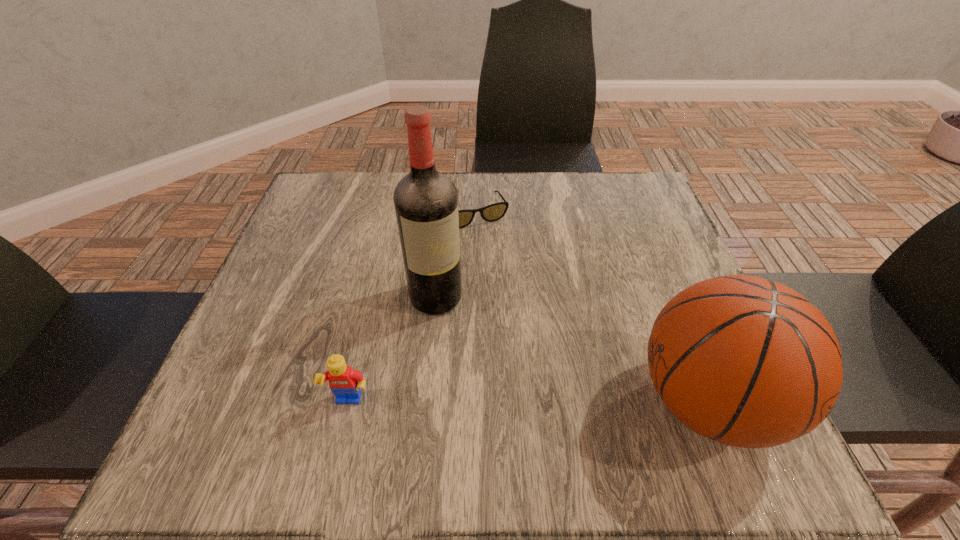
In the image, there is a desktop. In order to click on free space at the far edge in this screenshot , I will do `click(516, 196)`.

In the image, there is a desktop. Identify the location of vacant space at the near edge. (572, 372).

Find the location of a particular element. free point at the left edge is located at coordinates (291, 275).

I want to click on vacant space at the right edge of the desktop, so click(x=609, y=231).

Image resolution: width=960 pixels, height=540 pixels. In the image, there is a desktop. What are the coordinates of `vacant area at the far left corner` in the screenshot? It's located at (357, 177).

In the image, there is a desktop. What are the coordinates of `vacant region at the near left corner` in the screenshot? It's located at (304, 396).

The height and width of the screenshot is (540, 960). In the image, there is a desktop. Identify the location of vacant space at the far right corner. [599, 195].

The image size is (960, 540). I want to click on vacant space that's between the leftmost object and the sunglasses, so click(x=411, y=309).

Locate an element on the screen. empty location between the shortest object and the rightmost object is located at coordinates (589, 308).

What are the coordinates of `unoccupied area between the Lego and the farthest object` in the screenshot? It's located at (411, 309).